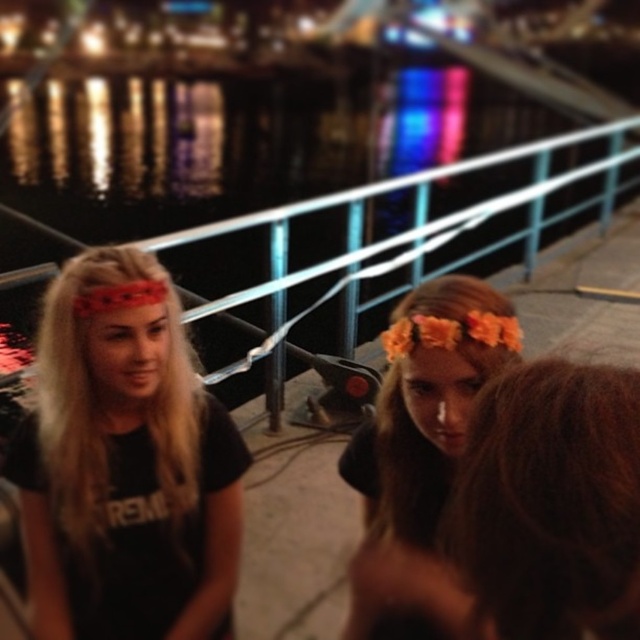
Question: Among these points, which one is nearest to the camera?

Choices:
 (A) (164, 340)
 (B) (460, 317)

Answer: (B)

Question: Can you confirm if matte black shirt at left is positioned to the right of floral headband at center?

Choices:
 (A) no
 (B) yes

Answer: (A)

Question: Can you confirm if matte black shirt at left is wider than brown curly hair at center?

Choices:
 (A) no
 (B) yes

Answer: (B)

Question: Can you confirm if matte black shirt at left is positioned to the left of brown curly hair at center?

Choices:
 (A) yes
 (B) no

Answer: (A)

Question: Which object appears farthest from the camera in this image?

Choices:
 (A) floral headband at center
 (B) brown curly hair at center
 (C) matte black shirt at left

Answer: (C)

Question: Which point appears farthest from the camera in this image?

Choices:
 (A) (476, 451)
 (B) (161, 355)
 (C) (388, 525)

Answer: (B)